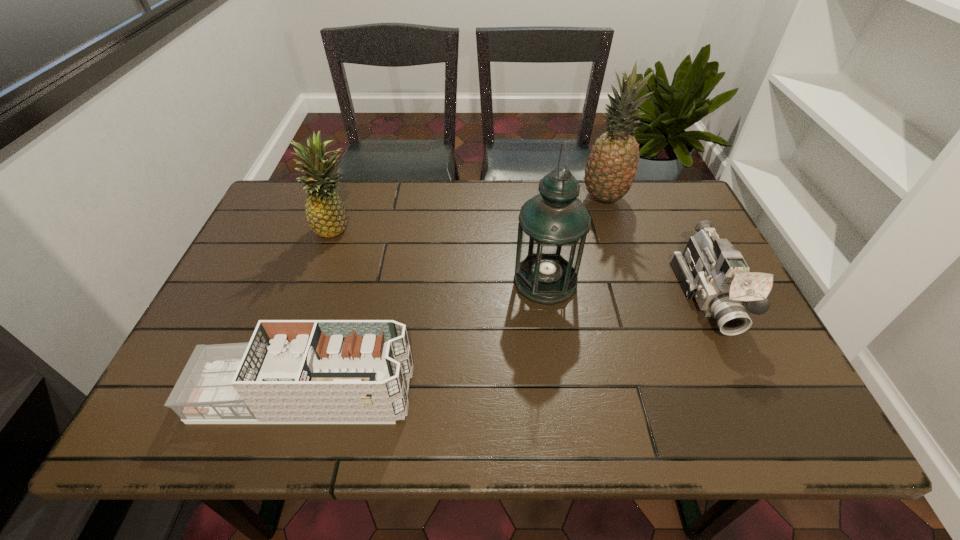
The height and width of the screenshot is (540, 960). Find the location of `empty space that is in between the nearest object and the taller pineapple`. empty space that is in between the nearest object and the taller pineapple is located at coordinates (454, 296).

This screenshot has height=540, width=960. I want to click on vacant space in between the taller pineapple and the left pineapple, so click(x=470, y=213).

The width and height of the screenshot is (960, 540). What are the coordinates of `blank region between the nearer pineapple and the nearest object` in the screenshot? It's located at (322, 311).

Select which object is the fourth closest to the oil lamp. Please provide its 2D coordinates. Your answer should be formatted as a tuple, i.e. [(x, y)], where the tuple contains the x and y coordinates of a point satisfying the conditions above.

[(326, 215)]

Identify the location of object that ranks as the second closest to the shorter pineapple. pyautogui.click(x=553, y=225).

Identify the location of free spot that satisfies the following two spatial constraints: 1. on the front-facing side of the camcorder; 2. at the entrance of the shortest object. (755, 394).

This screenshot has height=540, width=960. Identify the location of free region that satisfies the following two spatial constraints: 1. on the back side of the right pineapple; 2. on the left side of the third object from right to left. (534, 198).